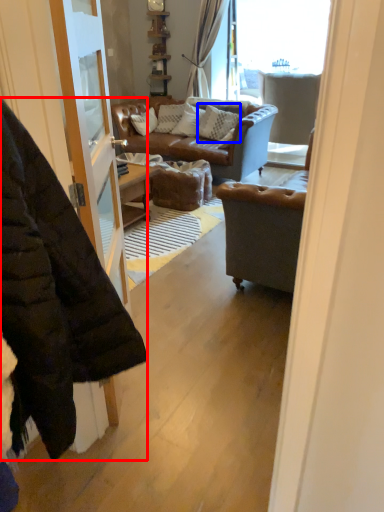
Question: Which object appears farthest to the camera in this image, jacket (highlighted by a red box) or pillow (highlighted by a blue box)?

Choices:
 (A) jacket
 (B) pillow

Answer: (B)